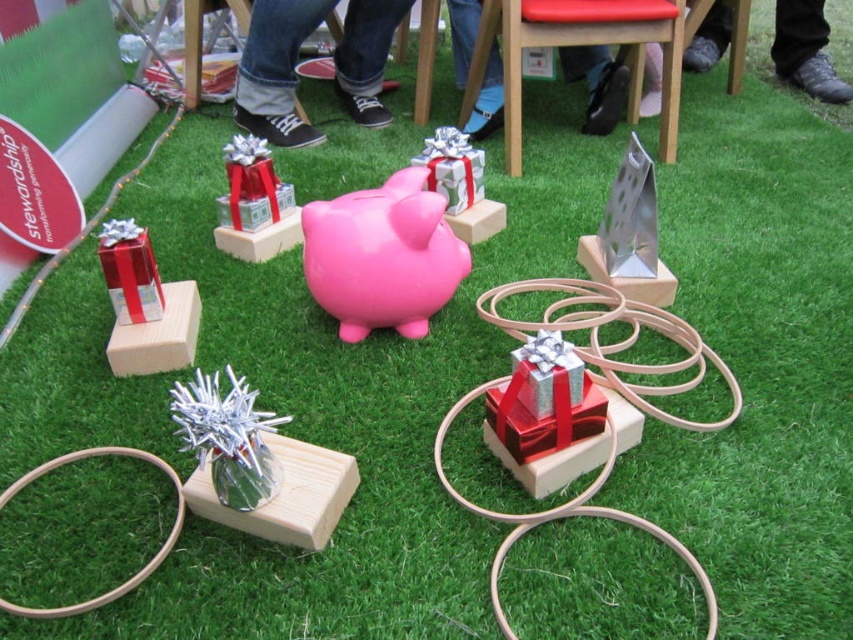
You are standing at the origin point of the coordinate system. You want to move towards the metallic silver chair at upper right. Which direction should you move in to reach it?

The metallic silver chair at upper right is located at coordinate point [589,44]. Since the origin is at [0,0], moving towards positive y direction would reach it.